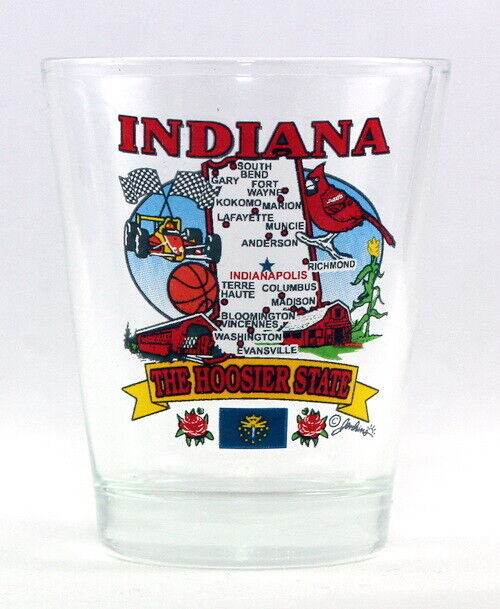
I want to click on glass, so click(391, 88).